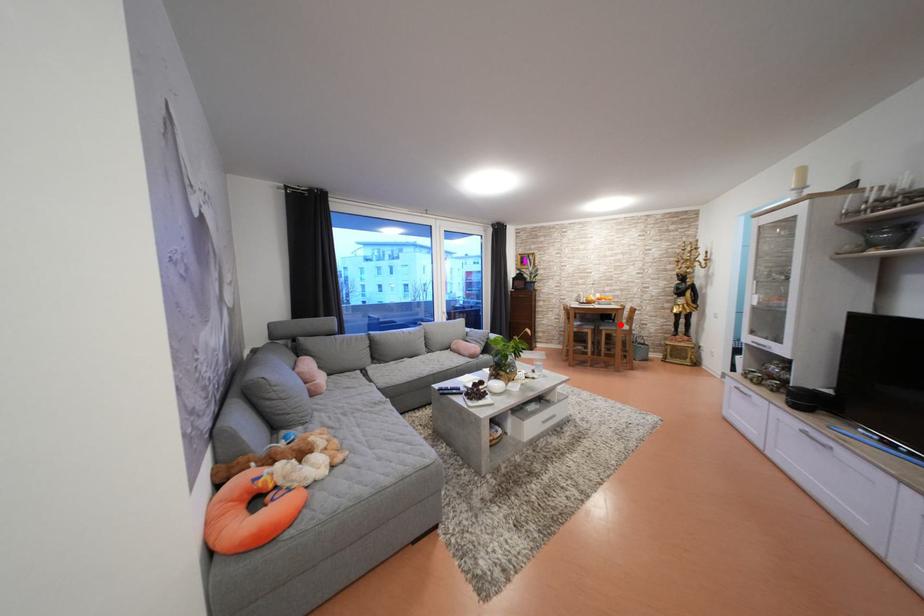
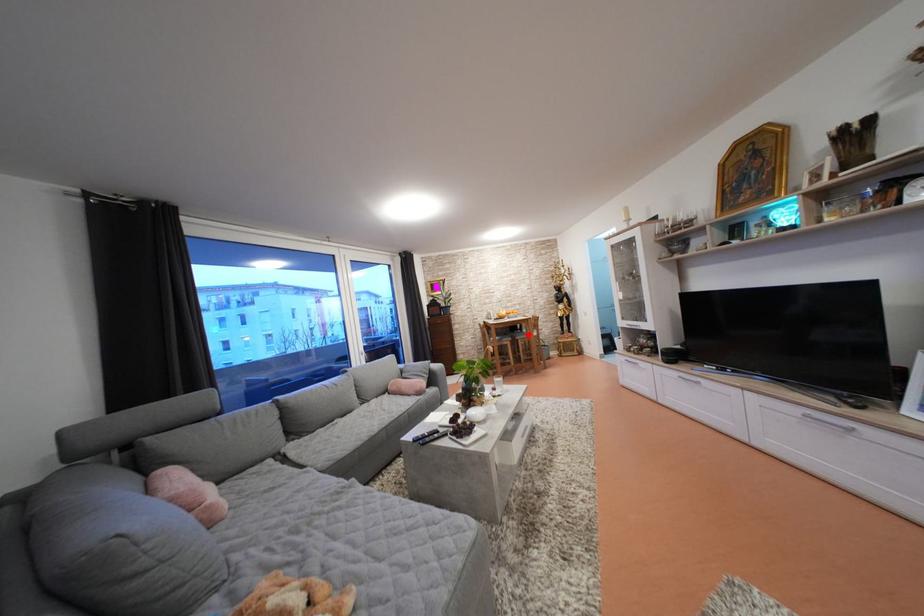
Based on the photo, I am providing you with two images of the same scene from different viewpoints. A red point is marked on the first image and another point is marked on the second image. Is the marked point in image1 the same physical position as the marked point in image2?

Yes